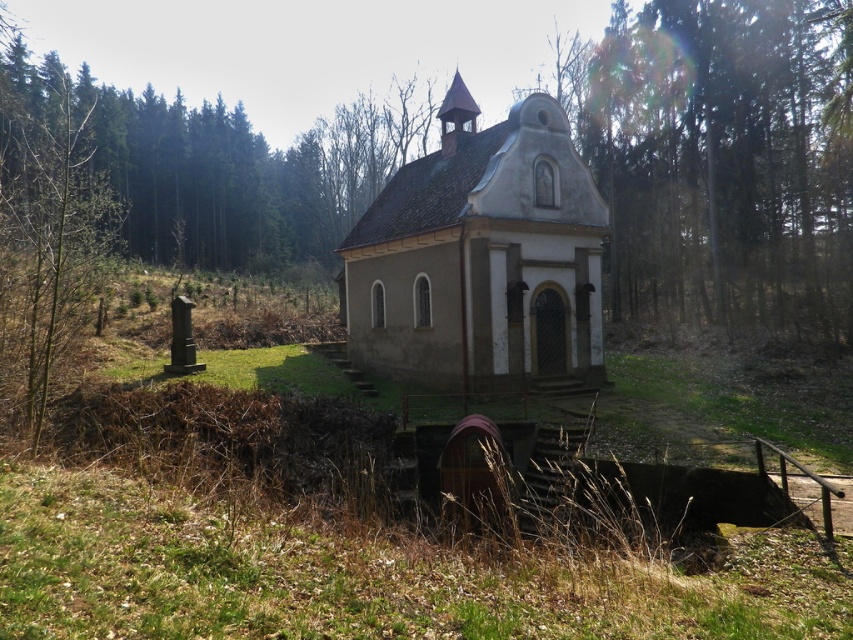
Can you confirm if beige stone church at center is bigger than brown wood tree at left?

Incorrect, beige stone church at center is not larger than brown wood tree at left.

The image size is (853, 640). In order to click on beige stone church at center in this screenshot , I will do `click(480, 257)`.

Where is `beige stone church at center`? The image size is (853, 640). beige stone church at center is located at coordinates (480, 257).